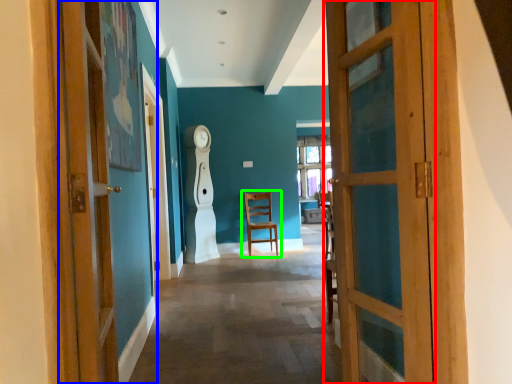
Question: Estimate the real-world distances between objects in this image. Which object is closer to door (highlighted by a red box), door (highlighted by a blue box) or chair (highlighted by a green box)?

Choices:
 (A) door
 (B) chair

Answer: (A)